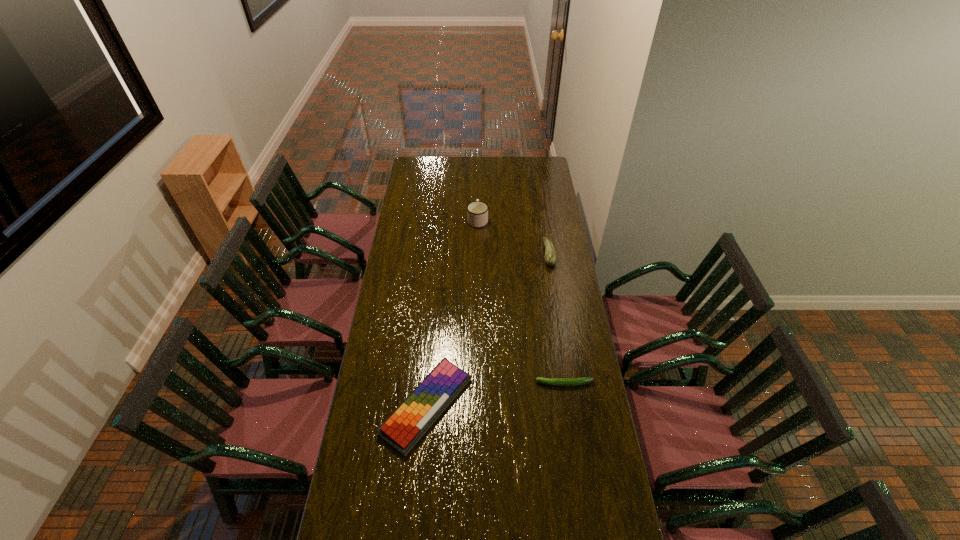
You are a GUI agent. You are given a task and a screenshot of the screen. Output one action in this format:
    pyautogui.click(x=<x>, y=<y>)
    Task: Click on the vacant space at the far left corner of the desktop
    
    Given the screenshot: What is the action you would take?
    pyautogui.click(x=420, y=164)

This screenshot has height=540, width=960. In order to click on vacant space that is in between the taller zucchini and the tallest object in this screenshot , I will do [514, 237].

This screenshot has width=960, height=540. I want to click on free spot between the farthest object and the third nearest object, so click(x=514, y=237).

Identify the location of vacant space that's between the second farthest object and the mug. (514, 237).

Locate an element on the screen. free space between the shorter zucchini and the computer keyboard is located at coordinates (495, 395).

The image size is (960, 540). Identify the location of vacant area between the farthest object and the computer keyboard. (452, 313).

You are a GUI agent. You are given a task and a screenshot of the screen. Output one action in this format:
    pyautogui.click(x=<x>, y=<y>)
    Task: Click on the vacant space in between the computer keyboard and the mug
    
    Given the screenshot: What is the action you would take?
    pyautogui.click(x=452, y=313)

Find the location of a particular element. free spot between the third tallest object and the nearer zucchini is located at coordinates (495, 395).

Identify the location of unoccupied area between the nearer zucchini and the computer keyboard. This screenshot has width=960, height=540. (495, 395).

Find the location of a particular element. The image size is (960, 540). free space between the third nearest object and the shortest object is located at coordinates 557,319.